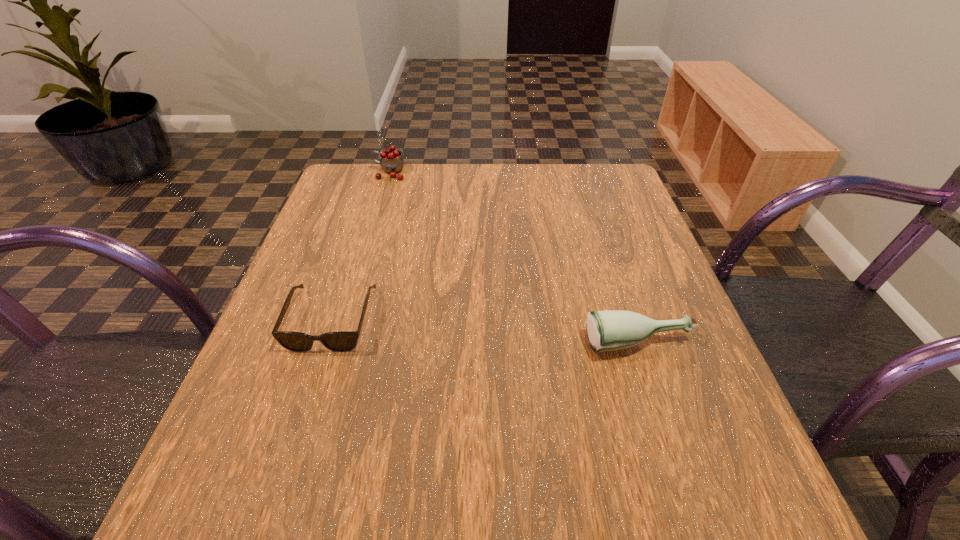
You are a GUI agent. You are given a task and a screenshot of the screen. Output one action in this format:
    pyautogui.click(x=<x>, y=<y>)
    Task: Click on the farthest object
    The width and height of the screenshot is (960, 540).
    Given the screenshot: What is the action you would take?
    pyautogui.click(x=392, y=162)

Identify the location of the tallest object. This screenshot has width=960, height=540. (392, 162).

Find the location of `bottle`. bottle is located at coordinates (610, 330).

Locate an element on the screen. This screenshot has width=960, height=540. the rightmost object is located at coordinates (610, 330).

This screenshot has height=540, width=960. I want to click on sunglasses, so click(341, 341).

Image resolution: width=960 pixels, height=540 pixels. I want to click on vacant space located on the handle side of the tallest object, so click(x=350, y=172).

This screenshot has width=960, height=540. I want to click on vacant space located on the handle side of the tallest object, so click(x=350, y=172).

Where is `free region located on the handle side of the tallest object`? The image size is (960, 540). free region located on the handle side of the tallest object is located at coordinates (353, 172).

In order to click on vacant space located on the back of the rightmost object in this screenshot , I will do click(x=621, y=290).

Identify the location of blank space located 0.120m at the front lenses of the shortest object. Image resolution: width=960 pixels, height=540 pixels. (300, 416).